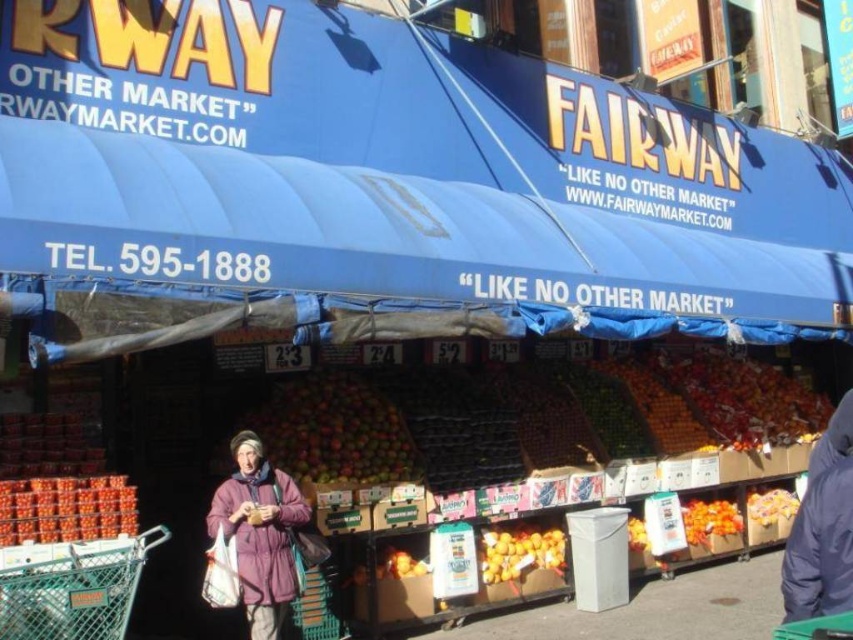
Based on the photo, you are a customer standing in front of the Fairway Market storefront. You see the shiny red apples at center and the orange matte fruit at center. Which fruit is closer to you?

The shiny red apples at center are closer to you because they are in front of the orange matte fruit at center.

You are a customer looking at the fresh produce display at the Fairway Market. You see the shiny red apples at center and the orange matte fruit at center. Which fruit is more to the left?

The shiny red apples at center is positioned on the left side of orange matte fruit at center, so the shiny red apples at center is more to the left.